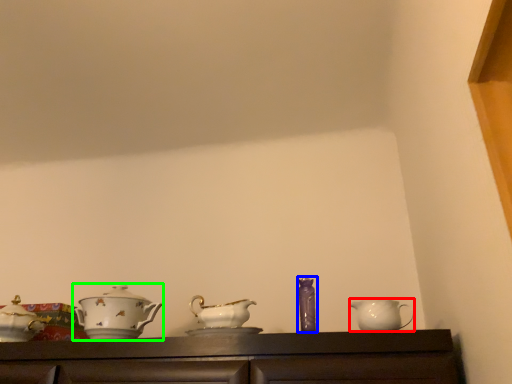
Question: Which object is the closest to the jug (highlighted by a red box)? Choose among these: tableware (highlighted by a blue box) or tableware (highlighted by a green box).

Choices:
 (A) tableware
 (B) tableware

Answer: (A)